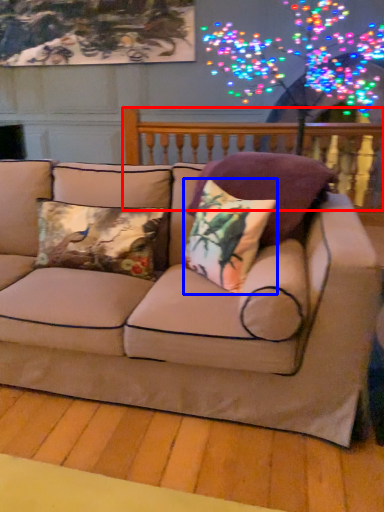
Question: Which object is closer to the camera taking this photo, balustrade (highlighted by a red box) or pillow (highlighted by a blue box)?

Choices:
 (A) balustrade
 (B) pillow

Answer: (B)